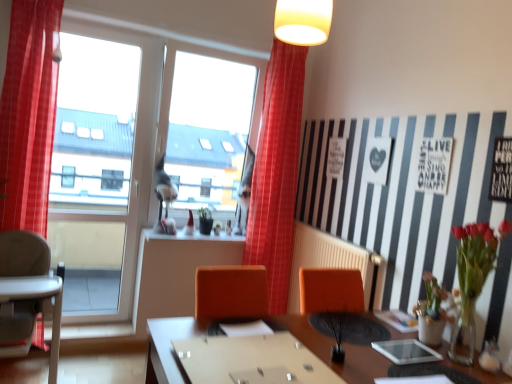
Question: Would you say gray plastic highchair at left is outside vivid red bouquet at right?

Choices:
 (A) yes
 (B) no

Answer: (A)

Question: Is gray plastic highchair at left turned away from vivid red bouquet at right?

Choices:
 (A) no
 (B) yes

Answer: (A)

Question: From the image's perspective, is gray plastic highchair at left below vivid red bouquet at right?

Choices:
 (A) no
 (B) yes

Answer: (B)

Question: Considering the relative sizes of gray plastic highchair at left and vivid red bouquet at right in the image provided, is gray plastic highchair at left thinner than vivid red bouquet at right?

Choices:
 (A) yes
 (B) no

Answer: (B)

Question: Does gray plastic highchair at left lie in front of vivid red bouquet at right?

Choices:
 (A) yes
 (B) no

Answer: (B)

Question: Considering the relative sizes of gray plastic highchair at left and vivid red bouquet at right in the image provided, is gray plastic highchair at left bigger than vivid red bouquet at right?

Choices:
 (A) yes
 (B) no

Answer: (A)

Question: Is gray plastic highchair at left bigger than red plaid curtain at left, marked as the first curtain in a front-to-back arrangement?

Choices:
 (A) no
 (B) yes

Answer: (B)

Question: Is gray plastic highchair at left thinner than red plaid curtain at left, which is the 2th curtain from right to left?

Choices:
 (A) yes
 (B) no

Answer: (B)

Question: Is gray plastic highchair at left positioned before red plaid curtain at left, placed as the 1th curtain when sorted from left to right?

Choices:
 (A) no
 (B) yes

Answer: (B)

Question: Does gray plastic highchair at left appear on the right side of red plaid curtain at left, marked as the first curtain in a front-to-back arrangement?

Choices:
 (A) yes
 (B) no

Answer: (A)

Question: Considering the relative sizes of gray plastic highchair at left and red plaid curtain at left, placed as the 1th curtain when sorted from left to right, in the image provided, is gray plastic highchair at left taller than red plaid curtain at left, placed as the 1th curtain when sorted from left to right,?

Choices:
 (A) no
 (B) yes

Answer: (A)

Question: Does gray plastic highchair at left have a smaller size compared to red plaid curtain at left, which is the 2th curtain from right to left?

Choices:
 (A) no
 (B) yes

Answer: (A)

Question: From the image's perspective, does green matte plant at center, the 2th plant viewed from the right, appear lower than white plastic radiator at center?

Choices:
 (A) yes
 (B) no

Answer: (B)